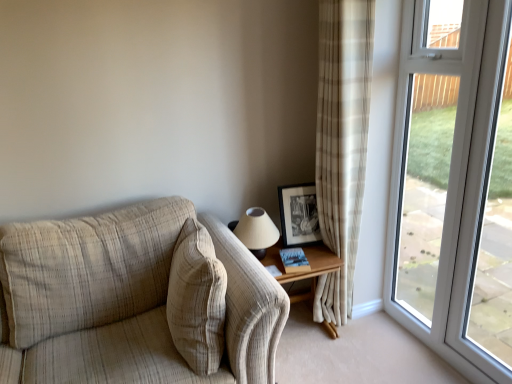
Where is `blank area beneath hardcover book at lower right (from a real-world perspective)`? The image size is (512, 384). blank area beneath hardcover book at lower right (from a real-world perspective) is located at coordinates (301, 261).